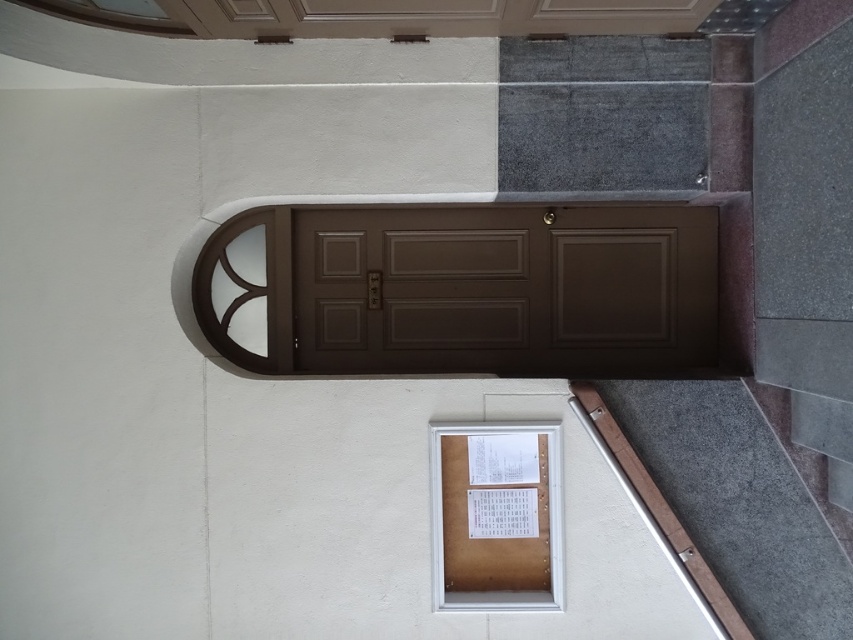
Question: Can you confirm if gray carpet at lower right is wider than brown cardboard window at lower center?

Choices:
 (A) yes
 (B) no

Answer: (A)

Question: Which of these objects is positioned closest to the gray carpet at lower right?

Choices:
 (A) brown matte door at center
 (B) brown cardboard window at lower center

Answer: (B)

Question: Which of the following is the farthest from the observer?

Choices:
 (A) (548, 579)
 (B) (461, 358)
 (C) (647, 417)

Answer: (B)

Question: Considering the relative positions of brown matte door at center and brown cardboard window at lower center in the image provided, where is brown matte door at center located with respect to brown cardboard window at lower center?

Choices:
 (A) right
 (B) left

Answer: (B)

Question: Which of the following is the closest to the observer?

Choices:
 (A) (508, 529)
 (B) (785, 461)
 (C) (418, 324)

Answer: (B)

Question: Can you confirm if brown matte door at center is positioned below brown cardboard window at lower center?

Choices:
 (A) yes
 (B) no

Answer: (B)